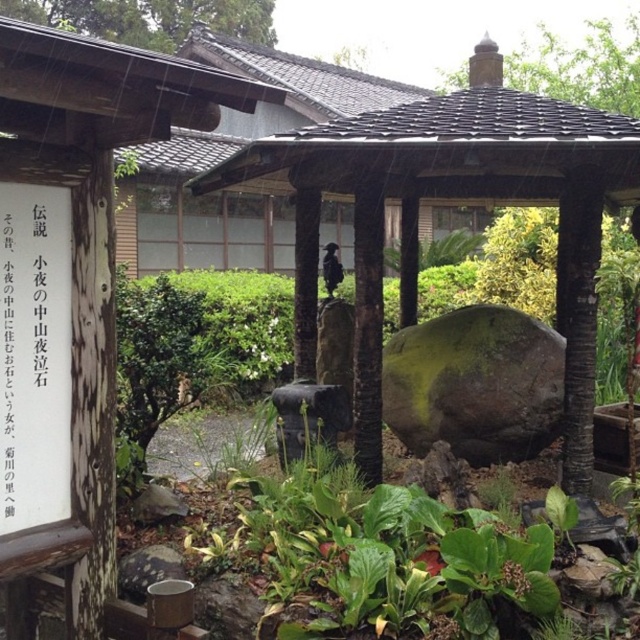
You are standing in a serene Japanese garden and want to find a place to sit. You see a smooth stone hut at center and a smooth wooden gazebo at center. Which one is located lower in the scene?

The smooth stone hut at center is located below the smooth wooden gazebo at center, so it is lower in the scene.

You are a visitor in the Japanese garden and want to know the distance between the smooth stone hut at center and the smooth wooden gazebo at center. Can you estimate how far apart they are?

The smooth stone hut at center is 7.36 feet from smooth wooden gazebo at center.

You are a visitor in the Japanese garden and want to locate the smooth stone hut at center. From your current position near the white paper sign at left, in which direction should you move to reach it?

You should move to your right because the smooth stone hut at center is located to the right of the white paper sign at left.